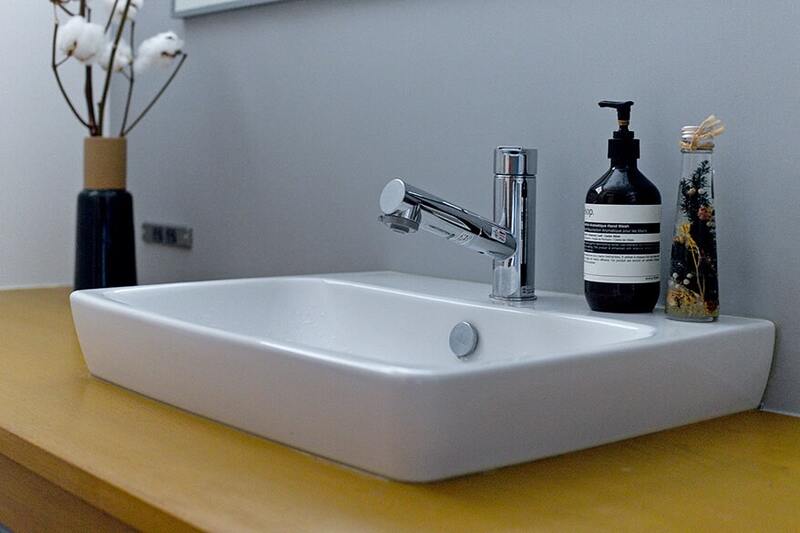
I want to click on glass container cover, so click(689, 128).